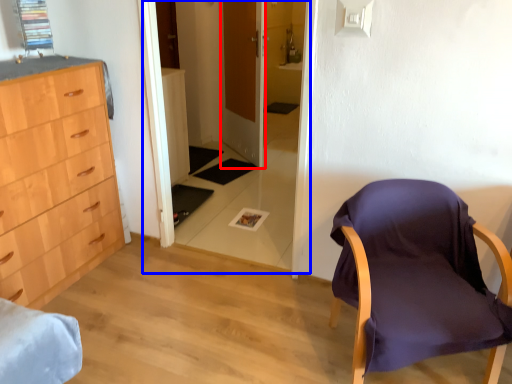
Question: Which point is further to the camera, door (highlighted by a red box) or glass door (highlighted by a blue box)?

Choices:
 (A) door
 (B) glass door

Answer: (A)